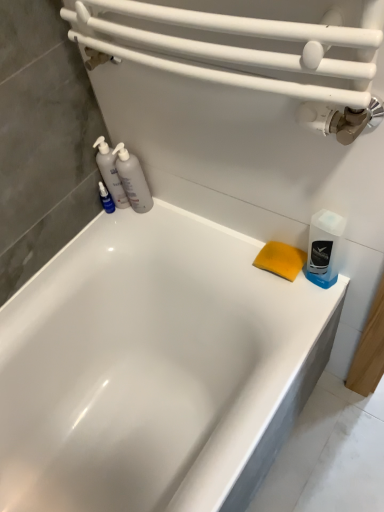
Question: Is translucent plastic bottles at left, the second cleaning product in the right-to-left sequence, to the left of blue translucent bottle at right, which is the first cleaning product in right-to-left order, from the viewer's perspective?

Choices:
 (A) no
 (B) yes

Answer: (B)

Question: Does translucent plastic bottles at left, marked as the second cleaning product in a left-to-right arrangement, have a lesser height compared to blue translucent bottle at right, which is the first cleaning product in right-to-left order?

Choices:
 (A) yes
 (B) no

Answer: (B)

Question: Is translucent plastic bottles at left, marked as the second cleaning product in a left-to-right arrangement, positioned far away from blue translucent bottle at right, which is counted as the third cleaning product, starting from the left?

Choices:
 (A) no
 (B) yes

Answer: (A)

Question: Is translucent plastic bottles at left, marked as the second cleaning product in a left-to-right arrangement, outside blue translucent bottle at right, which is the first cleaning product in right-to-left order?

Choices:
 (A) no
 (B) yes

Answer: (B)

Question: Are translucent plastic bottles at left, marked as the second cleaning product in a left-to-right arrangement, and blue translucent bottle at right, which is the first cleaning product in right-to-left order, making contact?

Choices:
 (A) no
 (B) yes

Answer: (A)

Question: Can you confirm if translucent plastic bottles at left, marked as the second cleaning product in a left-to-right arrangement, is bigger than blue translucent bottle at right, which is counted as the third cleaning product, starting from the left?

Choices:
 (A) yes
 (B) no

Answer: (A)

Question: Is translucent plastic bottles at left, placed as the 1th cleaning product when sorted from left to right, inside white glossy bathtub at center?

Choices:
 (A) yes
 (B) no

Answer: (B)

Question: Does white glossy bathtub at center have a greater width compared to translucent plastic bottles at left, which ranks as the third cleaning product in right-to-left order?

Choices:
 (A) yes
 (B) no

Answer: (A)

Question: Does white glossy bathtub at center come behind translucent plastic bottles at left, placed as the 1th cleaning product when sorted from left to right?

Choices:
 (A) no
 (B) yes

Answer: (A)

Question: Is white glossy bathtub at center to the right of translucent plastic bottles at left, which ranks as the third cleaning product in right-to-left order, from the viewer's perspective?

Choices:
 (A) no
 (B) yes

Answer: (B)

Question: Is white glossy bathtub at center next to translucent plastic bottles at left, which ranks as the third cleaning product in right-to-left order?

Choices:
 (A) yes
 (B) no

Answer: (B)

Question: Does white glossy bathtub at center have a lesser width compared to translucent plastic bottles at left, which ranks as the third cleaning product in right-to-left order?

Choices:
 (A) yes
 (B) no

Answer: (B)

Question: Can you confirm if translucent plastic bottles at left, marked as the second cleaning product in a left-to-right arrangement, is positioned to the right of translucent plastic bottles at left, which ranks as the third cleaning product in right-to-left order?

Choices:
 (A) yes
 (B) no

Answer: (A)